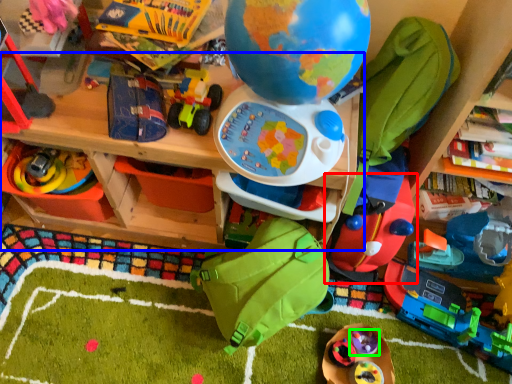
Question: Considering the real-world distances, which object is closest to toy (highlighted by a red box)? table (highlighted by a blue box) or toy (highlighted by a green box).

Choices:
 (A) table
 (B) toy

Answer: (B)